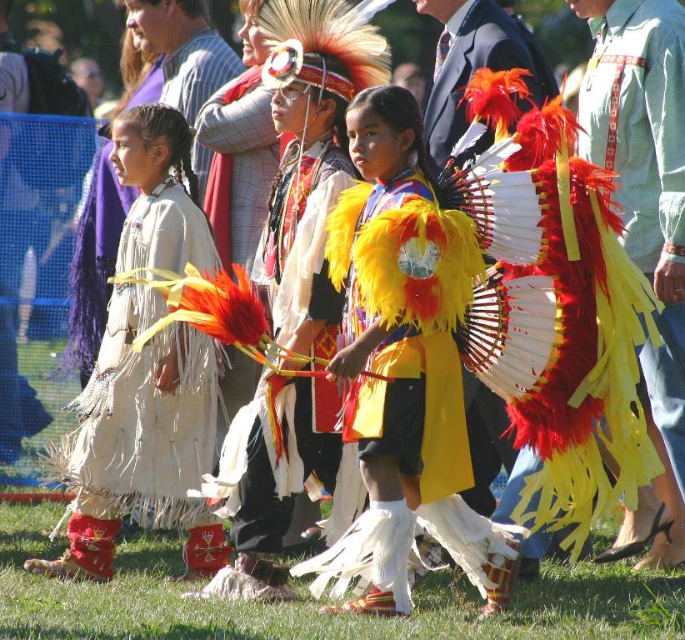
In the scene described, there are three children dressed in traditional attire. The first child on the left wears a beige fringe dress, the middle child has an elaborate headdress, and the third child is on the right. A specific point at coordinates (140, 440) is marked in the image. Which child is this point most likely indicating?

The point at (140, 440) marks the beige fringe dress at center, so this point is indicating the middle child who is wearing the elaborate headdress and stands at the center position among the three children.

In the scene, there are a yellow feather headdress at center and a smooth white shirt at upper center. Which object takes up more space in the image?

The yellow feather headdress at center is bigger than the smooth white shirt at upper center, so it takes up more space in the image.